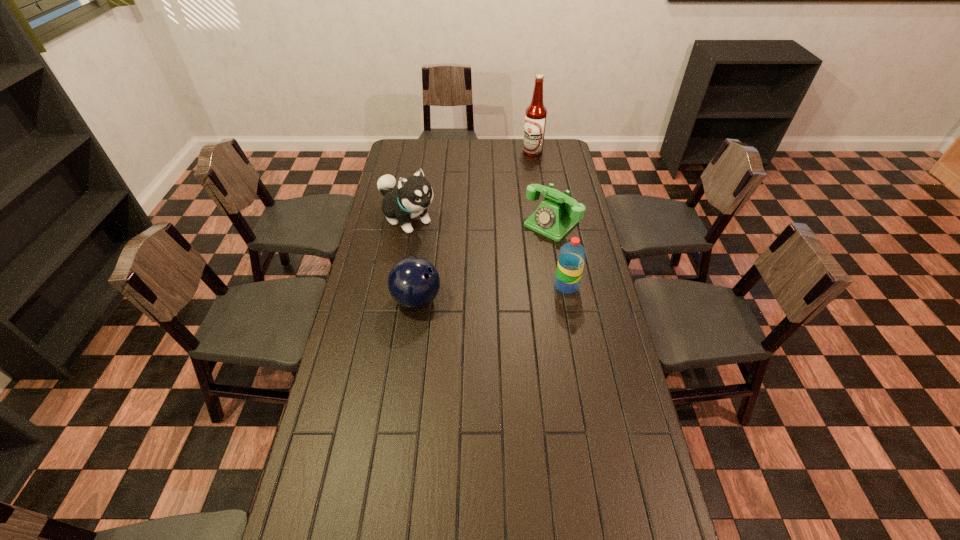
Where is `vacant space on the desktop that is between the bowling ball and the water bottle and is positioned on the label side of the tallest object`? Image resolution: width=960 pixels, height=540 pixels. vacant space on the desktop that is between the bowling ball and the water bottle and is positioned on the label side of the tallest object is located at coordinates [x=475, y=294].

Identify the location of free spot on the desktop that is between the bowling ball and the third tallest object and is positioned at the face of the puppy. (500, 292).

Locate an element on the screen. This screenshot has height=540, width=960. free spot on the desktop that is between the bowling ball and the water bottle and is positioned on the dial of the telephone is located at coordinates (475, 294).